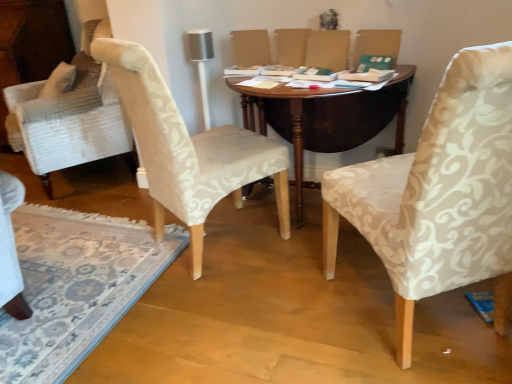
In the scene shown: In order to face white textured fabric chair at left, which appears as the 2th chair when viewed from the right, should I rotate leftwards or rightwards?

You should look left and rotate roughly 7.868 degrees.

The width and height of the screenshot is (512, 384). What are the coordinates of `dark wood table at center` in the screenshot? It's located at (327, 119).

This screenshot has width=512, height=384. Describe the element at coordinates (76, 286) in the screenshot. I see `patterned fabric rug at lower left` at that location.

Find the location of a particular element. Image resolution: width=512 pixels, height=384 pixels. white textured fabric chair at left, which appears as the 2th chair when viewed from the right is located at coordinates (188, 149).

Based on their sizes in the image, would you say white textured fabric chair at left, the 1th chair viewed from the left, is bigger or smaller than beige damask chair at right, which is the 2th chair from left to right?

Clearly, white textured fabric chair at left, the 1th chair viewed from the left, is smaller in size than beige damask chair at right, which is the 2th chair from left to right.

Is white textured fabric chair at left, which appears as the 2th chair when viewed from the right, thinner than beige damask chair at right, which is the 2th chair from left to right?

Yes.

Is white textured fabric chair at left, the 1th chair viewed from the left, turned away from beige damask chair at right, which is the 2th chair from left to right?

That's not correct — white textured fabric chair at left, the 1th chair viewed from the left, is not looking away from beige damask chair at right, which is the 2th chair from left to right.

How different are the orientations of white textured fabric chair at left, the 1th chair viewed from the left, and beige damask chair at right, which ranks as the first chair in right-to-left order, in degrees?

white textured fabric chair at left, the 1th chair viewed from the left, and beige damask chair at right, which ranks as the first chair in right-to-left order, are facing 74.1 degrees away from each other.

Is beige damask chair at right, which is the 2th chair from left to right, taller than dark wood table at center?

Yes.

Is dark wood table at center completely or partially inside beige damask chair at right, which is the 2th chair from left to right?

Definitely not — dark wood table at center is not inside beige damask chair at right, which is the 2th chair from left to right.

How many degrees apart are the facing directions of beige damask chair at right, which ranks as the first chair in right-to-left order, and dark wood table at center?

There is a 141-degree angle between the facing directions of beige damask chair at right, which ranks as the first chair in right-to-left order, and dark wood table at center.

From a real-world perspective, between beige damask chair at right, which is the 2th chair from left to right, and dark wood table at center, who is vertically higher?

In real-world perspective, beige damask chair at right, which is the 2th chair from left to right, is above.

Which is nearer, (x=106, y=277) or (x=370, y=239)?

Positioned in front is point (x=370, y=239).

Is patterned fabric rug at lower left far away from beige damask chair at right, which ranks as the first chair in right-to-left order?

That's right, there is a large distance between patterned fabric rug at lower left and beige damask chair at right, which ranks as the first chair in right-to-left order.

Considering the sizes of objects patterned fabric rug at lower left and beige damask chair at right, which ranks as the first chair in right-to-left order, in the image provided, who is bigger, patterned fabric rug at lower left or beige damask chair at right, which ranks as the first chair in right-to-left order,?

With larger size is patterned fabric rug at lower left.

From the image's perspective, would you say dark wood table at center is shown under white textured fabric chair at left, which appears as the 2th chair when viewed from the right?

No, from the image's perspective, dark wood table at center is not beneath white textured fabric chair at left, which appears as the 2th chair when viewed from the right.

From a real-world perspective, is dark wood table at center over white textured fabric chair at left, the 1th chair viewed from the left?

Incorrect, from a real-world perspective, dark wood table at center is lower than white textured fabric chair at left, the 1th chair viewed from the left.

Between dark wood table at center and white textured fabric chair at left, the 1th chair viewed from the left, which one has more height?

Standing taller between the two is white textured fabric chair at left, the 1th chair viewed from the left.

The height and width of the screenshot is (384, 512). In the image, there is a white textured fabric chair at left, the 1th chair viewed from the left. Find the location of `table below it (from a real-world perspective)`. table below it (from a real-world perspective) is located at coordinates (327, 119).

Does white textured fabric chair at left, which appears as the 2th chair when viewed from the right, have a larger size compared to dark wood table at center?

Incorrect, white textured fabric chair at left, which appears as the 2th chair when viewed from the right, is not larger than dark wood table at center.

Can we say white textured fabric chair at left, which appears as the 2th chair when viewed from the right, lies outside dark wood table at center?

Absolutely, white textured fabric chair at left, which appears as the 2th chair when viewed from the right, is external to dark wood table at center.

Considering the positions of points (159, 87) and (353, 124), is point (159, 87) closer to camera compared to point (353, 124)?

Yes, it is.

Is white textured fabric chair at left, which appears as the 2th chair when viewed from the right, in contact with dark wood table at center?

No, white textured fabric chair at left, which appears as the 2th chair when viewed from the right, is not touching dark wood table at center.

Is patterned fabric rug at lower left inside white textured fabric chair at left, which appears as the 2th chair when viewed from the right?

No, patterned fabric rug at lower left is not a part of white textured fabric chair at left, which appears as the 2th chair when viewed from the right.

Is white textured fabric chair at left, which appears as the 2th chair when viewed from the right, aimed at patterned fabric rug at lower left?

No, white textured fabric chair at left, which appears as the 2th chair when viewed from the right, is not turned towards patterned fabric rug at lower left.

Visually, is white textured fabric chair at left, the 1th chair viewed from the left, positioned to the left or to the right of patterned fabric rug at lower left?

Clearly, white textured fabric chair at left, the 1th chair viewed from the left, is on the right of patterned fabric rug at lower left in the image.

Image resolution: width=512 pixels, height=384 pixels. I want to click on chair on the right of the white textured fabric chair at left, which appears as the 2th chair when viewed from the right, so click(x=440, y=194).

Considering the positions of objects beige damask chair at right, which ranks as the first chair in right-to-left order, and white textured fabric chair at left, the 1th chair viewed from the left, in the image provided, who is more to the right, beige damask chair at right, which ranks as the first chair in right-to-left order, or white textured fabric chair at left, the 1th chair viewed from the left,?

From the viewer's perspective, beige damask chair at right, which ranks as the first chair in right-to-left order, appears more on the right side.

How distant is beige damask chair at right, which is the 2th chair from left to right, from white textured fabric chair at left, the 1th chair viewed from the left?

A distance of 26.82 inches exists between beige damask chair at right, which is the 2th chair from left to right, and white textured fabric chair at left, the 1th chair viewed from the left.

Looking at this image, between beige damask chair at right, which is the 2th chair from left to right, and white textured fabric chair at left, which appears as the 2th chair when viewed from the right, which one has larger width?

With larger width is beige damask chair at right, which is the 2th chair from left to right.

The height and width of the screenshot is (384, 512). What are the coordinates of `chair located on the right of white textured fabric chair at left, the 1th chair viewed from the left` in the screenshot? It's located at (440, 194).

At what (x,y) coordinates should I click in order to perform the action: click on table on the left of beige damask chair at right, which ranks as the first chair in right-to-left order. Please return your answer as a coordinate pair (x, y). Looking at the image, I should click on (327, 119).

Based on their spatial positions, is dark wood table at center or beige damask chair at right, which ranks as the first chair in right-to-left order, closer to white textured fabric chair at left, which appears as the 2th chair when viewed from the right?

The object closer to white textured fabric chair at left, which appears as the 2th chair when viewed from the right, is dark wood table at center.

When comparing their distances from patterned fabric rug at lower left, does beige damask chair at right, which ranks as the first chair in right-to-left order, or dark wood table at center seem closer?

dark wood table at center is positioned closer to the anchor patterned fabric rug at lower left.

Which object lies further to the anchor point white textured fabric chair at left, the 1th chair viewed from the left, dark wood table at center or patterned fabric rug at lower left?

patterned fabric rug at lower left is further to white textured fabric chair at left, the 1th chair viewed from the left.

From the image, which object appears to be farther from patterned fabric rug at lower left, white textured fabric chair at left, which appears as the 2th chair when viewed from the right, or beige damask chair at right, which ranks as the first chair in right-to-left order?

beige damask chair at right, which ranks as the first chair in right-to-left order.

From the image, which object appears to be nearer to beige damask chair at right, which ranks as the first chair in right-to-left order, white textured fabric chair at left, the 1th chair viewed from the left, or patterned fabric rug at lower left?

Among the two, white textured fabric chair at left, the 1th chair viewed from the left, is located nearer to beige damask chair at right, which ranks as the first chair in right-to-left order.

Looking at the image, which one is located closer to white textured fabric chair at left, which appears as the 2th chair when viewed from the right, beige damask chair at right, which ranks as the first chair in right-to-left order, or dark wood table at center?

dark wood table at center lies closer to white textured fabric chair at left, which appears as the 2th chair when viewed from the right, than the other object.

Looking at the image, which one is located further to patterned fabric rug at lower left, dark wood table at center or beige damask chair at right, which ranks as the first chair in right-to-left order?

beige damask chair at right, which ranks as the first chair in right-to-left order, lies further to patterned fabric rug at lower left than the other object.

Estimate the real-world distances between objects in this image. Which object is closer to dark wood table at center, patterned fabric rug at lower left or beige damask chair at right, which ranks as the first chair in right-to-left order?

Based on the image, beige damask chair at right, which ranks as the first chair in right-to-left order, appears to be nearer to dark wood table at center.

Where is `chair between patterned fabric rug at lower left and dark wood table at center`? The height and width of the screenshot is (384, 512). chair between patterned fabric rug at lower left and dark wood table at center is located at coordinates (188, 149).

Where is `table located between white textured fabric chair at left, which appears as the 2th chair when viewed from the right, and beige damask chair at right, which is the 2th chair from left to right, in the left-right direction`? The width and height of the screenshot is (512, 384). table located between white textured fabric chair at left, which appears as the 2th chair when viewed from the right, and beige damask chair at right, which is the 2th chair from left to right, in the left-right direction is located at coordinates (327, 119).

Identify the location of table located between patterned fabric rug at lower left and beige damask chair at right, which is the 2th chair from left to right, in the left-right direction. The height and width of the screenshot is (384, 512). (327, 119).

The height and width of the screenshot is (384, 512). Identify the location of chair situated between patterned fabric rug at lower left and beige damask chair at right, which is the 2th chair from left to right, from left to right. (188, 149).